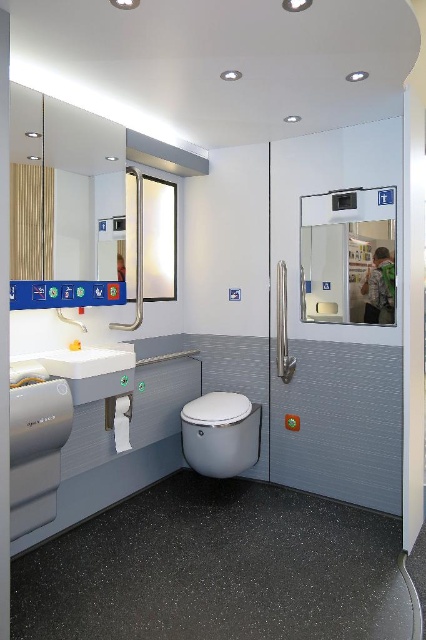
Between clear glass mirror at center and white glossy toilet bowl at center, which one has more height?

With more height is clear glass mirror at center.

Where is `clear glass mirror at center`? The image size is (426, 640). clear glass mirror at center is located at coordinates (348, 257).

Which is in front, point (313, 321) or point (238, 445)?

Point (238, 445) is more forward.

The image size is (426, 640). I want to click on clear glass mirror at center, so click(348, 257).

Does clear glass mirror at center appear on the right side of white glossy sink at left?

Yes, clear glass mirror at center is to the right of white glossy sink at left.

Which is in front, point (362, 292) or point (106, 371)?

Point (106, 371)

This screenshot has width=426, height=640. Describe the element at coordinates (348, 257) in the screenshot. I see `clear glass mirror at center` at that location.

You are a GUI agent. You are given a task and a screenshot of the screen. Output one action in this format:
    pyautogui.click(x=<x>, y=<y>)
    Task: Click on the clear glass mirror at center
    The image size is (426, 640).
    Given the screenshot: What is the action you would take?
    pyautogui.click(x=348, y=257)

Who is shorter, matte glass mirror at upper center or white glossy sink at left?

white glossy sink at left is shorter.

What do you see at coordinates (51, 173) in the screenshot? Image resolution: width=426 pixels, height=640 pixels. I see `matte glass mirror at upper center` at bounding box center [51, 173].

This screenshot has height=640, width=426. Identify the location of matte glass mirror at upper center. (51, 173).